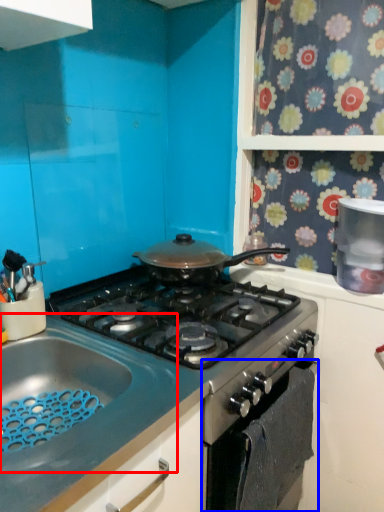
Question: Which object appears closest to the camera in this image, sink (highlighted by a red box) or oven (highlighted by a blue box)?

Choices:
 (A) sink
 (B) oven

Answer: (A)